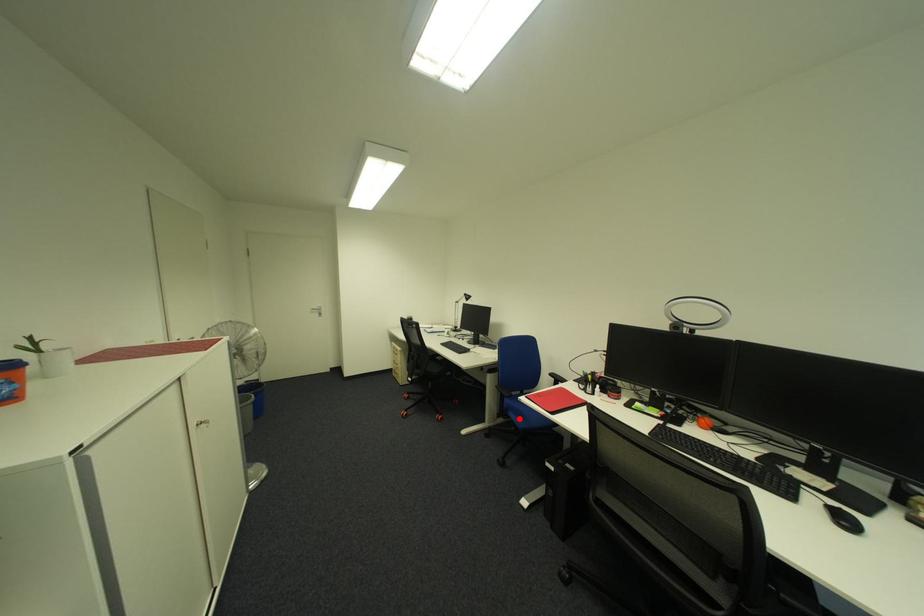
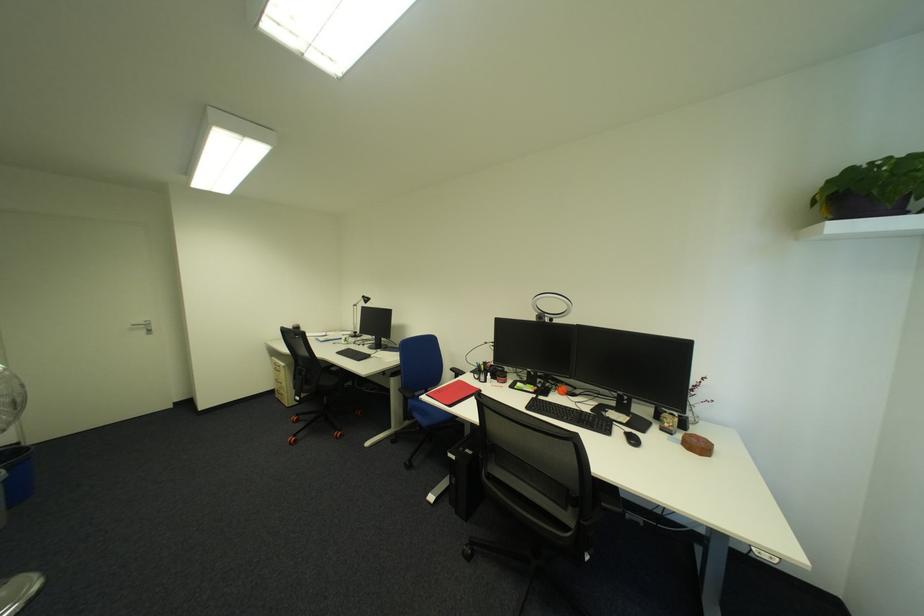
Question: I am providing you with two images of the same scene from different viewpoints. Image1 has a red point marked. In image2, the corresponding 3D location appears at what relative position? Reply with the corresponding letter.

Choices:
 (A) Closer
 (B) Farther

Answer: (B)